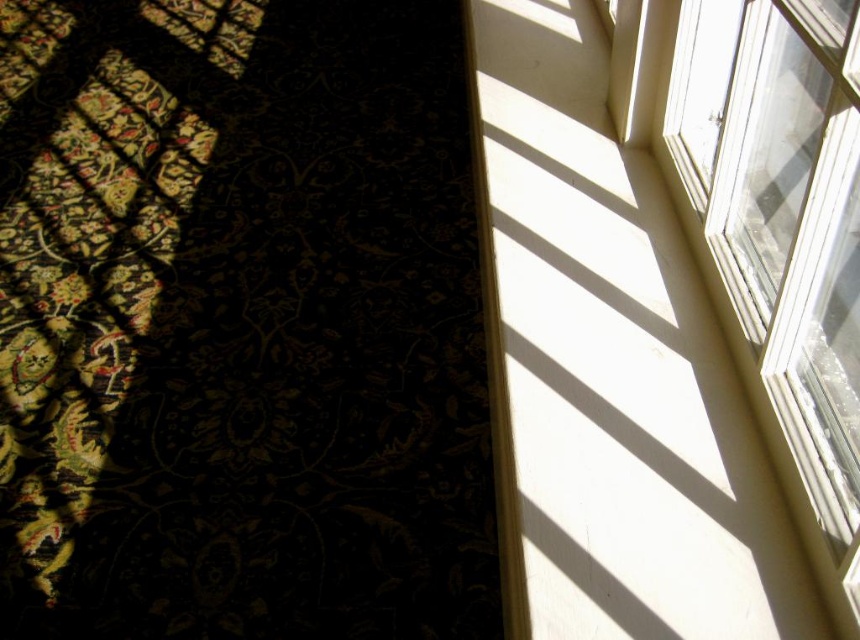
You are standing in the room and want to place a small potted plant on the floor. The plant needs to be placed exactly at point coordinates 0.464, 0.142. Can you confirm if this location is on the dark floral carpet at lower left?

The dark floral carpet at lower left is located at point [121,296], so yes, placing the plant at those coordinates will place it on the dark floral carpet at lower left.

You are standing in the room and want to move from the dark floral carpet at lower left to the clear glass window at upper right. Which direction should you move to reach the window?

To reach the clear glass window at upper right from the dark floral carpet at lower left, you should move towards the right and upwards since the window is positioned to the right side of the carpet.